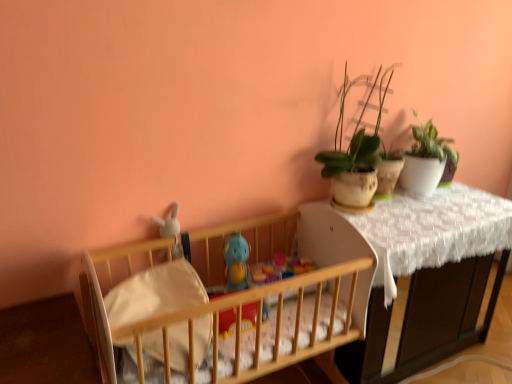
Question: Can you confirm if white plush rabbit at left, the 1th toy viewed from the left, is shorter than wooden crib at left?

Choices:
 (A) no
 (B) yes

Answer: (B)

Question: From a real-world perspective, is white plush rabbit at left, the second toy positioned from the right, under wooden crib at left?

Choices:
 (A) yes
 (B) no

Answer: (B)

Question: Is there a large distance between white plush rabbit at left, the 1th toy viewed from the left, and wooden crib at left?

Choices:
 (A) yes
 (B) no

Answer: (B)

Question: Is white plush rabbit at left, the 1th toy viewed from the left, in contact with wooden crib at left?

Choices:
 (A) no
 (B) yes

Answer: (A)

Question: Is white plush rabbit at left, the 1th toy viewed from the left, outside of wooden crib at left?

Choices:
 (A) no
 (B) yes

Answer: (A)

Question: From a real-world perspective, relative to white soft crib sheet at center, is white lace-covered table at upper right vertically above or below?

Choices:
 (A) below
 (B) above

Answer: (A)

Question: From the image's perspective, is white lace-covered table at upper right above or below white soft crib sheet at center?

Choices:
 (A) below
 (B) above

Answer: (A)

Question: Relative to white soft crib sheet at center, is white lace-covered table at upper right in front or behind?

Choices:
 (A) behind
 (B) front

Answer: (A)

Question: Is point (352, 216) positioned closer to the camera than point (119, 319)?

Choices:
 (A) farther
 (B) closer

Answer: (A)

Question: From the image's perspective, is white plush rabbit at left, the second toy positioned from the right, located above or below wooden crib at left?

Choices:
 (A) below
 (B) above

Answer: (B)

Question: Which is correct: white plush rabbit at left, the second toy positioned from the right, is inside wooden crib at left, or outside of it?

Choices:
 (A) outside
 (B) inside

Answer: (B)

Question: Would you say white plush rabbit at left, the 1th toy viewed from the left, is to the left or to the right of wooden crib at left in the picture?

Choices:
 (A) right
 (B) left

Answer: (B)

Question: Is point (173, 256) closer or farther from the camera than point (229, 337)?

Choices:
 (A) closer
 (B) farther

Answer: (B)

Question: From the image's perspective, is green matte plant at upper right, placed as the 2th houseplant when sorted from left to right, located above or below blue rubber duck at center, which ranks as the first toy in right-to-left order?

Choices:
 (A) above
 (B) below

Answer: (A)

Question: Visually, is green matte plant at upper right, marked as the first houseplant in a right-to-left arrangement, positioned to the left or to the right of blue rubber duck at center, positioned as the second toy in left-to-right order?

Choices:
 (A) right
 (B) left

Answer: (A)